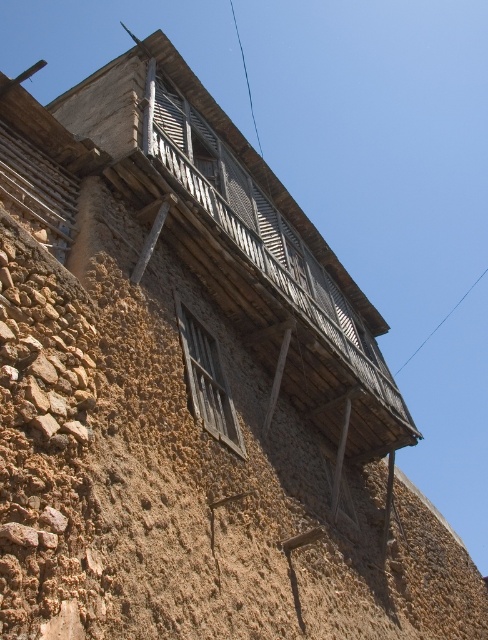
You are an architect inspecting the building. You need to determine which part of the structure, the brown rough stone wall at center or the wooden at upper center, extends higher towards the sky. Based on the scene, which one is taller?

The brown rough stone wall at center has a greater height compared to wooden at upper center, so the brown rough stone wall at center extends higher towards the sky.

You are standing in front of the traditional building and want to touch both the brown rough stone wall at center and the wooden at upper center. Which one can you reach without stretching your arms too much?

The brown rough stone wall at center is closer to the viewer than the wooden at upper center, so you can reach it without stretching your arms too much.

You are an architect examining the traditional building. You notice the brown rough stone wall at center and the wooden at upper center. Which of these two objects is located higher up in the image?

The wooden at upper center is located higher up in the image than the brown rough stone wall at center.